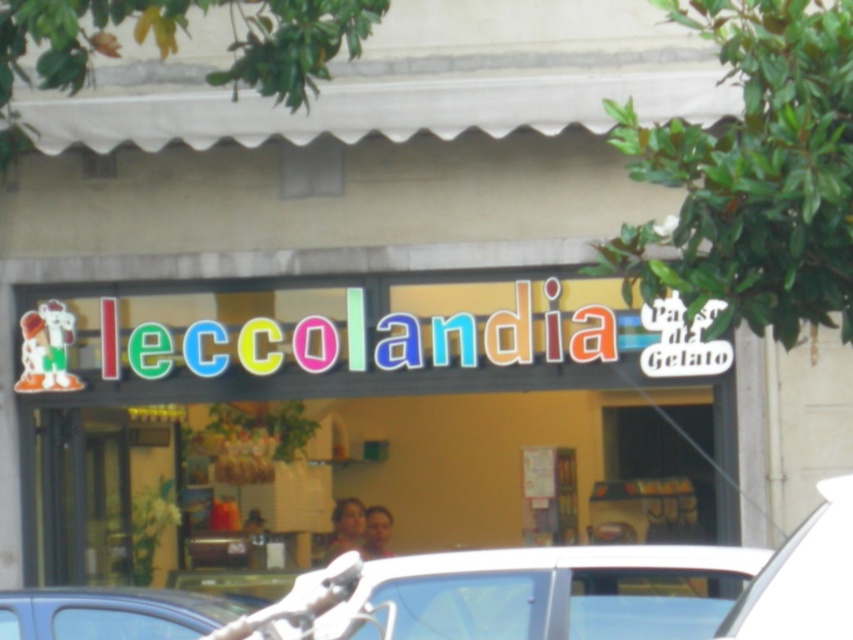
You are a customer standing outside the gelato shop and want to park your car. You have two cars available to choose from. One is the white glossy car at lower center and the other is the white matte car at lower right. Based on the scene, which car would require more space to park?

The white glossy car at lower center requires more space to park because its width is larger than the white matte car at lower right.

You are a customer standing outside the gelato shop looking through the window. You see two cars parked outside. Which car is positioned to the left of the other? The options are the white glossy car at lower center and the white matte car at lower right.

The white glossy car at lower center is positioned to the left of the white matte car at lower right.

Based on the photo, you are a delivery person who needs to park a 35 inch wide delivery van between the white glossy car at lower center and the white matte car at lower right. Can the van fit in the space between them?

The white glossy car at lower center is 34.93 inches from the white matte car at lower right. Since the van is 35 inches wide, it is slightly wider than the available space. The van cannot fit between them.